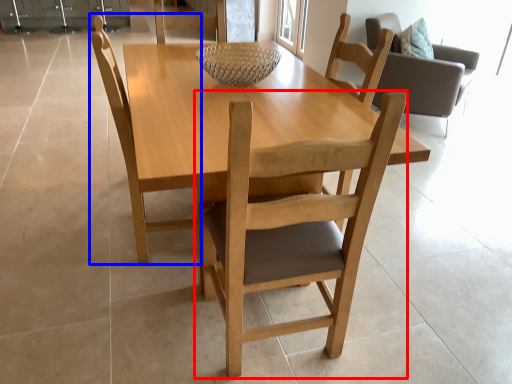
Question: Among these objects, which one is farthest to the camera, chair (highlighted by a red box) or chair (highlighted by a blue box)?

Choices:
 (A) chair
 (B) chair

Answer: (B)